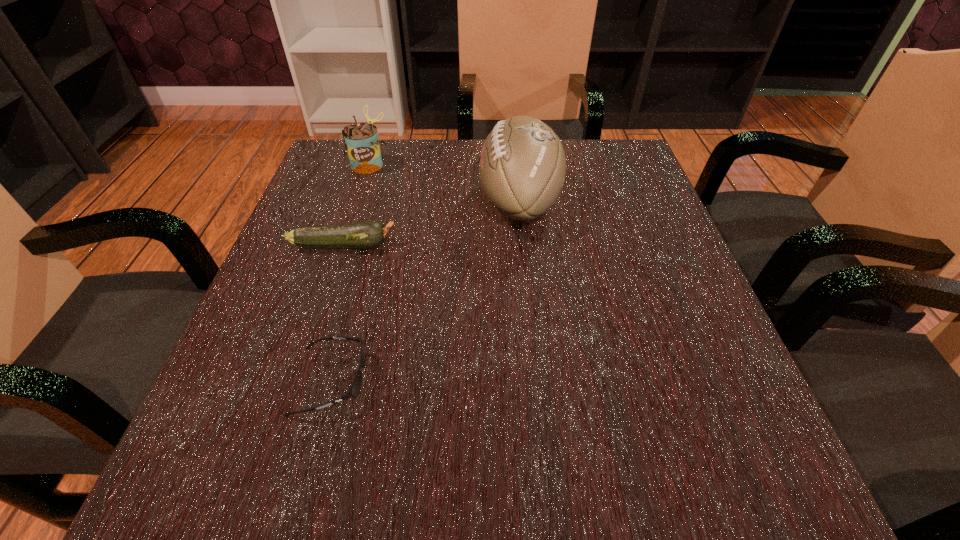
The image size is (960, 540). I want to click on vacant region at the right edge of the desktop, so click(664, 219).

Identify the location of vacant area at the far left corner. 340,176.

The height and width of the screenshot is (540, 960). In order to click on vacant area that lies between the third tallest object and the sunglasses in this screenshot , I will do `click(337, 313)`.

Find the location of a particular element. This screenshot has height=540, width=960. free spot between the can and the rightmost object is located at coordinates (444, 183).

You are a GUI agent. You are given a task and a screenshot of the screen. Output one action in this format:
    pyautogui.click(x=<x>, y=<y>)
    Task: Click on the free space that is in between the nearest object and the zucchini
    
    Given the screenshot: What is the action you would take?
    pyautogui.click(x=337, y=313)

Where is `free space between the tallest object and the second tallest object`? The height and width of the screenshot is (540, 960). free space between the tallest object and the second tallest object is located at coordinates (444, 183).

Where is `vacant space that's between the can and the football (American)`? vacant space that's between the can and the football (American) is located at coordinates pos(444,183).

Find the location of a particular element. empty space between the nearest object and the third shortest object is located at coordinates (349, 272).

Find the location of a particular element. The width and height of the screenshot is (960, 540). blank region between the third shortest object and the third tallest object is located at coordinates (x=356, y=205).

Where is `vacant space in between the tallest object and the second shortest object`? vacant space in between the tallest object and the second shortest object is located at coordinates (431, 224).